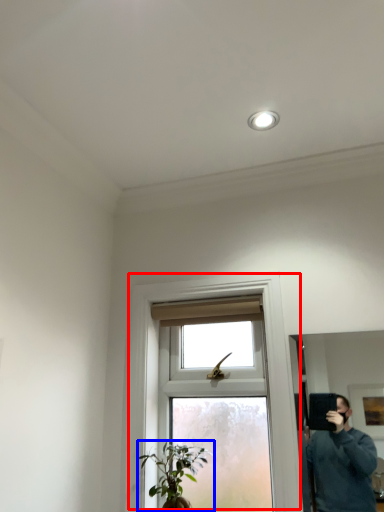
Question: Which object is further to the camera taking this photo, window (highlighted by a red box) or houseplant (highlighted by a blue box)?

Choices:
 (A) window
 (B) houseplant

Answer: (B)